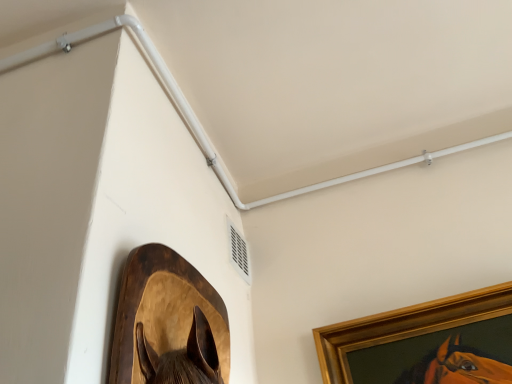
Image resolution: width=512 pixels, height=384 pixels. What do you see at coordinates (168, 323) in the screenshot?
I see `wooden horse head at lower left, arranged as the 2th picture frame when viewed from the right` at bounding box center [168, 323].

Where is `white plastic pipe at upper center`? This screenshot has height=384, width=512. white plastic pipe at upper center is located at coordinates (374, 171).

The width and height of the screenshot is (512, 384). What do you see at coordinates (374, 171) in the screenshot?
I see `white plastic pipe at upper center` at bounding box center [374, 171].

This screenshot has width=512, height=384. Identify the location of white plastic air conditioning unit at upper center. (238, 252).

In terms of height, does white plastic air conditioning unit at upper center look taller or shorter compared to wooden horse head at lower left, marked as the first picture frame in a front-to-back arrangement?

Considering their sizes, white plastic air conditioning unit at upper center has less height than wooden horse head at lower left, marked as the first picture frame in a front-to-back arrangement.

From the image's perspective, is white plastic air conditioning unit at upper center located above wooden horse head at lower left, marked as the first picture frame in a front-to-back arrangement?

Yes, from the image's perspective, white plastic air conditioning unit at upper center is above wooden horse head at lower left, marked as the first picture frame in a front-to-back arrangement.

Consider the image. Is white plastic air conditioning unit at upper center at the left side of wooden horse head at lower left, acting as the first picture frame starting from the left?

No, white plastic air conditioning unit at upper center is not to the left of wooden horse head at lower left, acting as the first picture frame starting from the left.

Is white plastic air conditioning unit at upper center not inside gold wooden picture frame at upper right, the second picture frame positioned from the left?

white plastic air conditioning unit at upper center lies outside gold wooden picture frame at upper right, the second picture frame positioned from the left,'s area.

Is white plastic air conditioning unit at upper center wider than gold wooden picture frame at upper right, acting as the first picture frame starting from the right?

Incorrect, the width of white plastic air conditioning unit at upper center does not surpass that of gold wooden picture frame at upper right, acting as the first picture frame starting from the right.

Is point (230, 224) less distant than point (461, 313)?

No.

The width and height of the screenshot is (512, 384). In order to click on picture frame to the right of white plastic pipe at upper center in this screenshot , I will do `click(424, 343)`.

In terms of width, does white plastic pipe at upper center look wider or thinner when compared to gold wooden picture frame at upper right, acting as the second picture frame starting from the front?

white plastic pipe at upper center is thinner than gold wooden picture frame at upper right, acting as the second picture frame starting from the front.

Is white plastic pipe at upper center far away from gold wooden picture frame at upper right, the second picture frame positioned from the left?

No, white plastic pipe at upper center is not far away from gold wooden picture frame at upper right, the second picture frame positioned from the left.

In the scene shown: From a real-world perspective, is white plastic air conditioning unit at upper center beneath white plastic pipe at upper center?

Indeed, from a real-world perspective, white plastic air conditioning unit at upper center is positioned beneath white plastic pipe at upper center.

In the scene shown: From the image's perspective, is white plastic air conditioning unit at upper center above or below white plastic pipe at upper center?

white plastic air conditioning unit at upper center is below white plastic pipe at upper center.

Is white plastic air conditioning unit at upper center thinner than white plastic pipe at upper center?

Yes, white plastic air conditioning unit at upper center is thinner than white plastic pipe at upper center.

Find the location of a particular element. Image resolution: width=512 pixels, height=384 pixels. beam on the right of white plastic air conditioning unit at upper center is located at coordinates (374, 171).

Is wooden horse head at lower left, marked as the first picture frame in a front-to-back arrangement, turned away from white plastic pipe at upper center?

wooden horse head at lower left, marked as the first picture frame in a front-to-back arrangement, is not turned away from white plastic pipe at upper center.

From the image's perspective, which is above, wooden horse head at lower left, which is the second picture frame in back-to-front order, or white plastic pipe at upper center?

From the image's view, white plastic pipe at upper center is above.

Looking at this image, can white plastic pipe at upper center be found inside wooden horse head at lower left, which is the second picture frame in back-to-front order?

Actually, white plastic pipe at upper center is outside wooden horse head at lower left, which is the second picture frame in back-to-front order.

Looking at this image, considering the positions of objects wooden horse head at lower left, acting as the first picture frame starting from the left, and white plastic pipe at upper center in the image provided, who is in front, wooden horse head at lower left, acting as the first picture frame starting from the left, or white plastic pipe at upper center?

wooden horse head at lower left, acting as the first picture frame starting from the left, is in front.

In the image, is white plastic pipe at upper center on the left side or the right side of white plastic air conditioning unit at upper center?

Clearly, white plastic pipe at upper center is on the right of white plastic air conditioning unit at upper center in the image.

This screenshot has width=512, height=384. I want to click on beam located above the white plastic air conditioning unit at upper center (from the image's perspective), so click(374, 171).

Is white plastic pipe at upper center positioned with its back to white plastic air conditioning unit at upper center?

No, white plastic pipe at upper center is not facing the opposite direction of white plastic air conditioning unit at upper center.

How many degrees apart are the facing directions of white plastic pipe at upper center and white plastic air conditioning unit at upper center?

The angle between the facing direction of white plastic pipe at upper center and the facing direction of white plastic air conditioning unit at upper center is 89 degrees.

Can you tell me how much wooden horse head at lower left, marked as the first picture frame in a front-to-back arrangement, and gold wooden picture frame at upper right, arranged as the first picture frame when viewed from the back, differ in facing direction?

The angular difference between wooden horse head at lower left, marked as the first picture frame in a front-to-back arrangement, and gold wooden picture frame at upper right, arranged as the first picture frame when viewed from the back, is 88.6 degrees.

Which object is positioned more to the right, wooden horse head at lower left, marked as the first picture frame in a front-to-back arrangement, or gold wooden picture frame at upper right, acting as the first picture frame starting from the right?

Positioned to the right is gold wooden picture frame at upper right, acting as the first picture frame starting from the right.

Is wooden horse head at lower left, acting as the first picture frame starting from the left, with gold wooden picture frame at upper right, acting as the first picture frame starting from the right?

No.

Which object is closer to the camera taking this photo, wooden horse head at lower left, which is the second picture frame in back-to-front order, or gold wooden picture frame at upper right, acting as the second picture frame starting from the front?

wooden horse head at lower left, which is the second picture frame in back-to-front order.

Identify the location of picture frame that appears on the left of white plastic air conditioning unit at upper center. Image resolution: width=512 pixels, height=384 pixels. (168, 323).

Locate an element on the screen. The width and height of the screenshot is (512, 384). picture frame to the right of white plastic air conditioning unit at upper center is located at coordinates (424, 343).

Which object lies further to the anchor point gold wooden picture frame at upper right, arranged as the first picture frame when viewed from the back, white plastic pipe at upper center or wooden horse head at lower left, marked as the first picture frame in a front-to-back arrangement?

Based on the image, wooden horse head at lower left, marked as the first picture frame in a front-to-back arrangement, appears to be further to gold wooden picture frame at upper right, arranged as the first picture frame when viewed from the back.

Which object lies further to the anchor point white plastic air conditioning unit at upper center, gold wooden picture frame at upper right, acting as the second picture frame starting from the front, or wooden horse head at lower left, arranged as the 2th picture frame when viewed from the right?

Based on the image, wooden horse head at lower left, arranged as the 2th picture frame when viewed from the right, appears to be further to white plastic air conditioning unit at upper center.

Looking at the image, which one is located further to white plastic pipe at upper center, white plastic air conditioning unit at upper center or gold wooden picture frame at upper right, acting as the first picture frame starting from the right?

The object further to white plastic pipe at upper center is gold wooden picture frame at upper right, acting as the first picture frame starting from the right.

When comparing their distances from white plastic pipe at upper center, does wooden horse head at lower left, arranged as the 2th picture frame when viewed from the right, or gold wooden picture frame at upper right, acting as the second picture frame starting from the front, seem further?

wooden horse head at lower left, arranged as the 2th picture frame when viewed from the right, is positioned further to the anchor white plastic pipe at upper center.

Considering their positions, is wooden horse head at lower left, which is the second picture frame in back-to-front order, positioned further to white plastic air conditioning unit at upper center than white plastic pipe at upper center?

wooden horse head at lower left, which is the second picture frame in back-to-front order, is positioned further to the anchor white plastic air conditioning unit at upper center.

Looking at the image, which one is located further to white plastic air conditioning unit at upper center, white plastic pipe at upper center or wooden horse head at lower left, arranged as the 2th picture frame when viewed from the right?

The object further to white plastic air conditioning unit at upper center is wooden horse head at lower left, arranged as the 2th picture frame when viewed from the right.

Estimate the real-world distances between objects in this image. Which object is further from white plastic pipe at upper center, white plastic air conditioning unit at upper center or wooden horse head at lower left, acting as the first picture frame starting from the left?

wooden horse head at lower left, acting as the first picture frame starting from the left, is positioned further to the anchor white plastic pipe at upper center.

Estimate the real-world distances between objects in this image. Which object is further from wooden horse head at lower left, arranged as the 2th picture frame when viewed from the right, white plastic air conditioning unit at upper center or white plastic pipe at upper center?

white plastic pipe at upper center is further to wooden horse head at lower left, arranged as the 2th picture frame when viewed from the right.

At what (x,y) coordinates should I click in order to perform the action: click on beam between white plastic air conditioning unit at upper center and gold wooden picture frame at upper right, acting as the second picture frame starting from the front, in the horizontal direction. Please return your answer as a coordinate pair (x, y). The width and height of the screenshot is (512, 384). Looking at the image, I should click on (374, 171).

The height and width of the screenshot is (384, 512). Identify the location of air conditioning located between wooden horse head at lower left, which is the second picture frame in back-to-front order, and white plastic pipe at upper center in the depth direction. (238, 252).

The width and height of the screenshot is (512, 384). Identify the location of picture frame between wooden horse head at lower left, which is the second picture frame in back-to-front order, and white plastic pipe at upper center in the front-back direction. (424, 343).

You are a GUI agent. You are given a task and a screenshot of the screen. Output one action in this format:
    pyautogui.click(x=<x>, y=<y>)
    Task: Click on the picture frame located between wooden horse head at lower left, arranged as the 2th picture frame when viewed from the right, and white plastic air conditioning unit at upper center in the depth direction
    
    Given the screenshot: What is the action you would take?
    pyautogui.click(x=424, y=343)